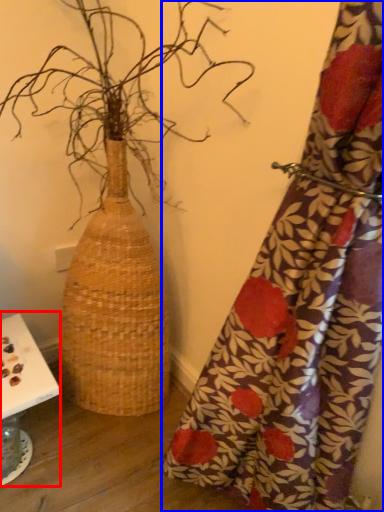
Question: Which object is closer to the camera taking this photo, table (highlighted by a red box) or curtain (highlighted by a blue box)?

Choices:
 (A) table
 (B) curtain

Answer: (B)